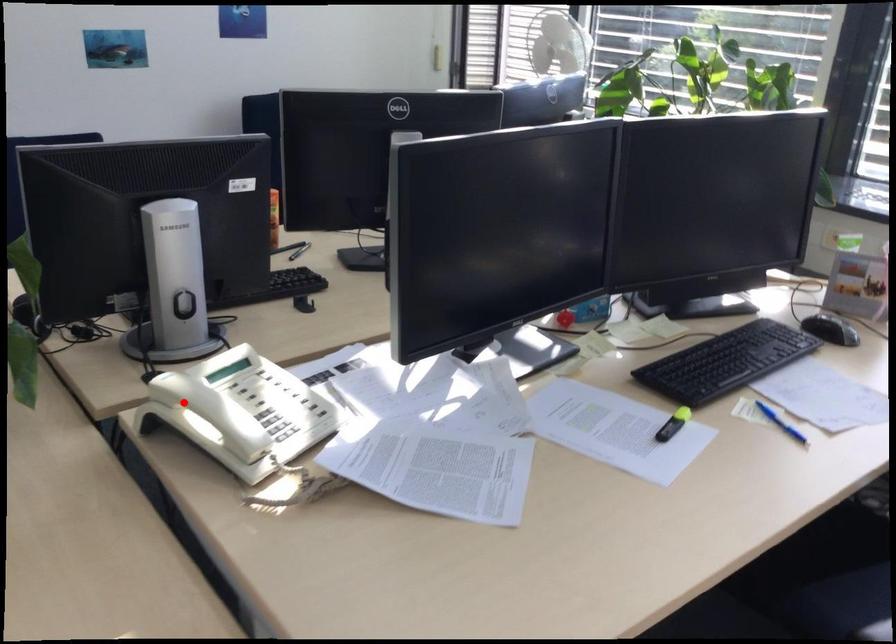
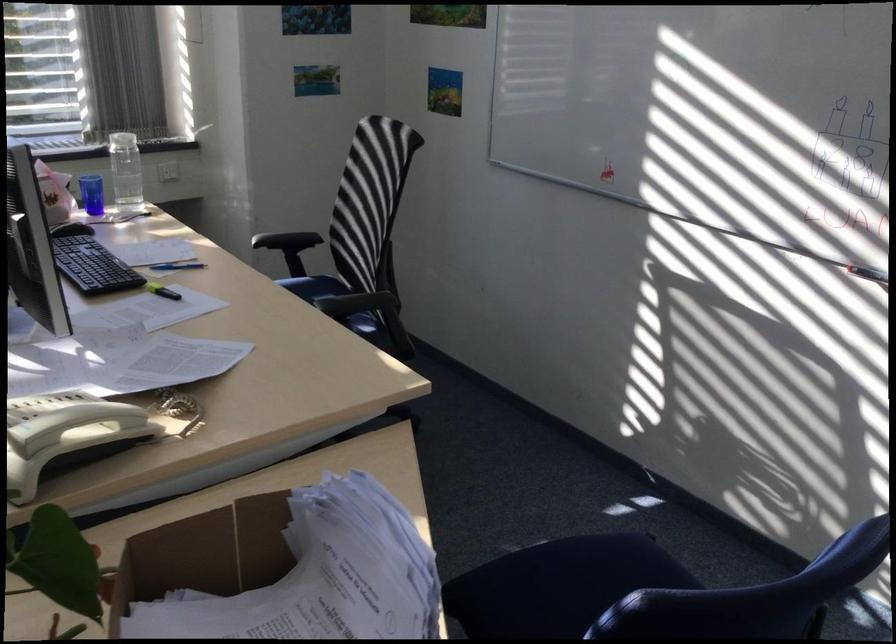
In the second image, find the point that corresponds to the highlighted location in the first image.

(62, 418)